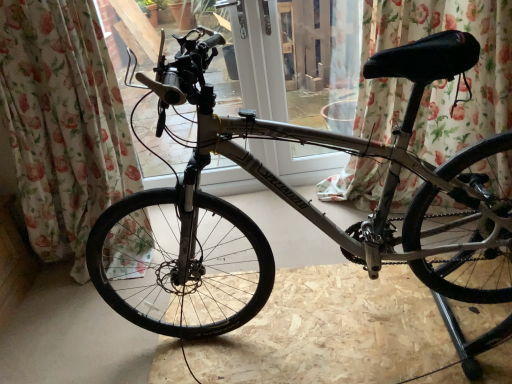
The width and height of the screenshot is (512, 384). Find the location of `free space on the front side of floral fabric curtain at left, positioned as the second curtain in right-to-left order`. free space on the front side of floral fabric curtain at left, positioned as the second curtain in right-to-left order is located at coordinates (70, 327).